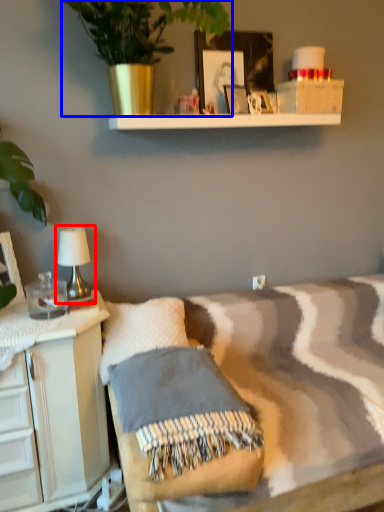
Question: Among these objects, which one is farthest to the camera, table lamp (highlighted by a red box) or houseplant (highlighted by a blue box)?

Choices:
 (A) table lamp
 (B) houseplant

Answer: (A)